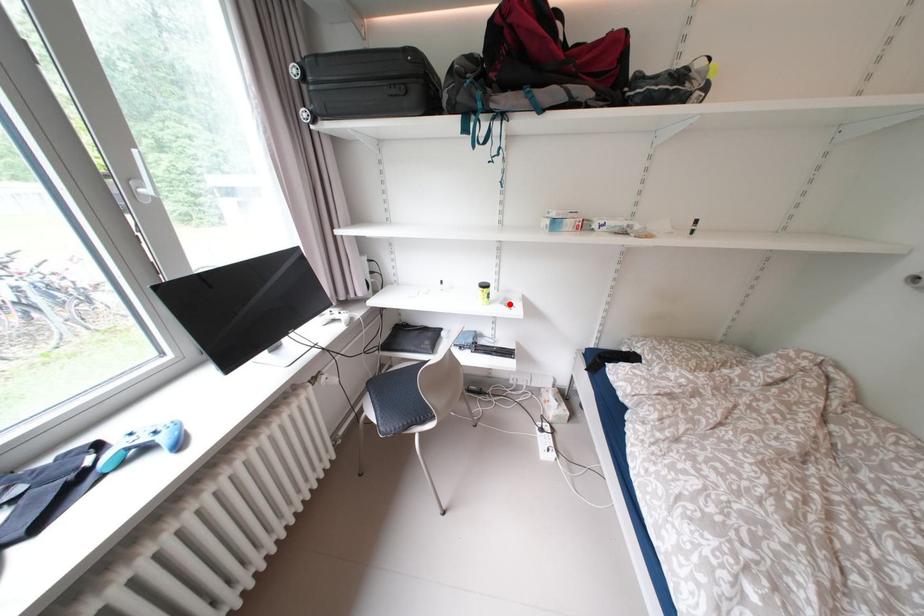
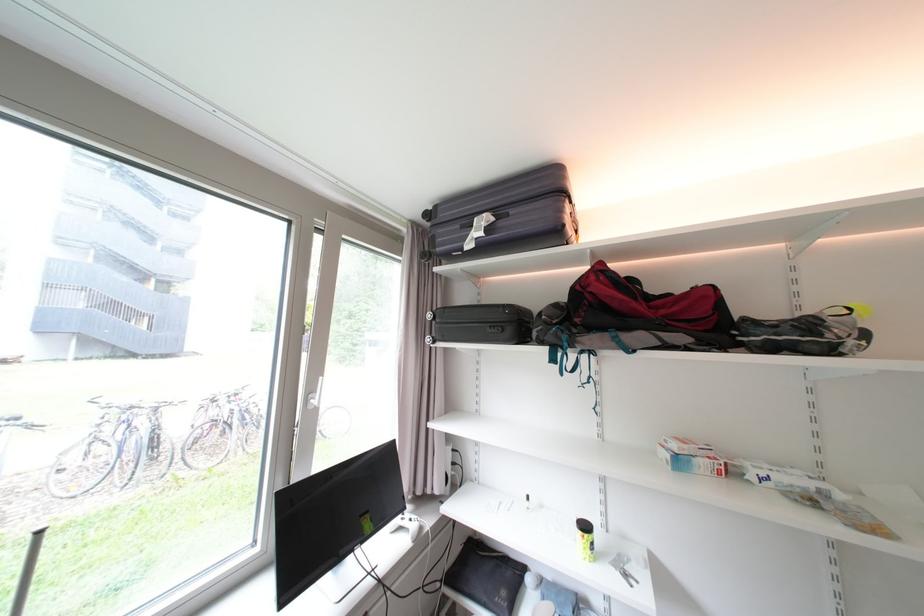
Locate, in the second image, the point that corresponds to the highlighted location in the first image.

(623, 565)